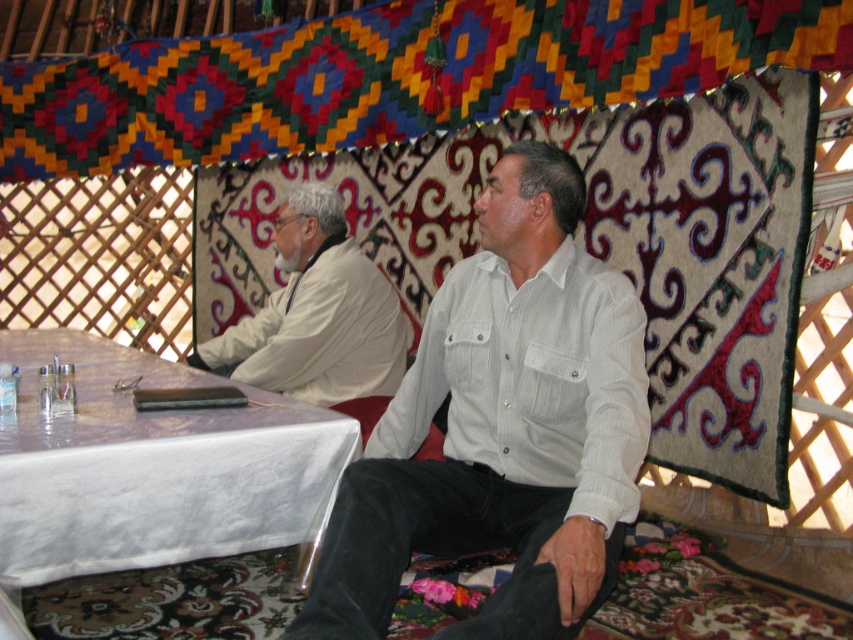
You are standing at the entrance of the yurt and want to place a tray on the white cloth table at lower left. To reach it, you must pass by the white matte shirt at upper left. Is the table located to the left or right side of the shirt?

The white cloth table at lower left is to the left of the white matte shirt at upper left. Therefore, to reach the table, you should move to the left side of the shirt.

You are standing at the point marked by the coordinate point at (x=606, y=564) in the yurt. You want to reach the entrance located at the opposite side of the yurt. If your walking speed is 1.2 meters per second, how many seconds will it take you to reach the entrance?

The distance between the point at (x=606, y=564) and the entrance is 1.84 meters. At a walking speed of 1.2 meters per second, it would take approximately 1.53 seconds to reach the entrance.

You are planning to take a photo of the white striped shirt at center and the white cloth table at lower left inside the yurt. Which object should you focus on first if you want to capture both in a single frame without moving the camera?

The white striped shirt at center should be focused on first because it is taller than the white cloth table at lower left, so adjusting focus to the taller object ensures both are in frame.